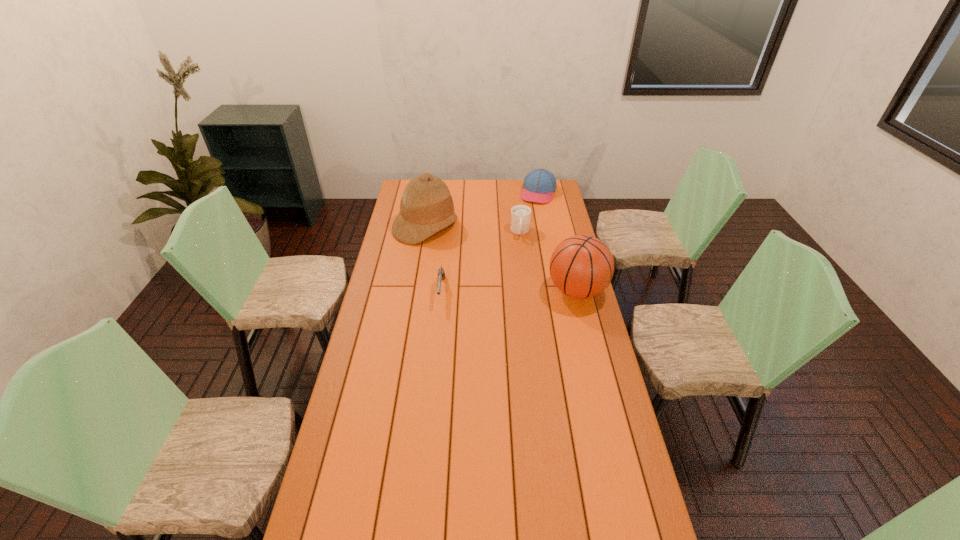
This screenshot has width=960, height=540. In order to click on free space between the baseball cap and the shortest object in this screenshot , I will do `click(490, 241)`.

You are a GUI agent. You are given a task and a screenshot of the screen. Output one action in this format:
    pyautogui.click(x=<x>, y=<y>)
    Task: Click on the vacant space in between the farthest object and the gun
    
    Given the screenshot: What is the action you would take?
    pyautogui.click(x=490, y=241)

Locate an element on the screen. empty location between the cappuccino and the basketball is located at coordinates (548, 261).

The image size is (960, 540). I want to click on unoccupied position between the hat and the cappuccino, so click(x=472, y=230).

Identify the location of object that can be found as the second closest to the shortest object. This screenshot has width=960, height=540. (520, 214).

Identify which object is the second closest to the shortest object. Please provide its 2D coordinates. Your answer should be formatted as a tuple, i.e. [(x, y)], where the tuple contains the x and y coordinates of a point satisfying the conditions above.

[(520, 214)]

Locate an element on the screen. Image resolution: width=960 pixels, height=540 pixels. vacant region that satisfies the following two spatial constraints: 1. aiming along the barrel of the gun; 2. on the left side of the basketball is located at coordinates (442, 291).

You are a GUI agent. You are given a task and a screenshot of the screen. Output one action in this format:
    pyautogui.click(x=<x>, y=<y>)
    Task: Click on the vacant space that satisfies the following two spatial constraints: 1. aiming along the barrel of the shortest object; 2. on the right side of the basketball
    
    Given the screenshot: What is the action you would take?
    pyautogui.click(x=442, y=291)

Identify the location of vacant space that satisfies the following two spatial constraints: 1. on the front side of the cappuccino; 2. on the left side of the hat. (424, 232).

This screenshot has height=540, width=960. I want to click on vacant space that satisfies the following two spatial constraints: 1. on the front side of the cappuccino; 2. on the left side of the basketball, so click(x=527, y=291).